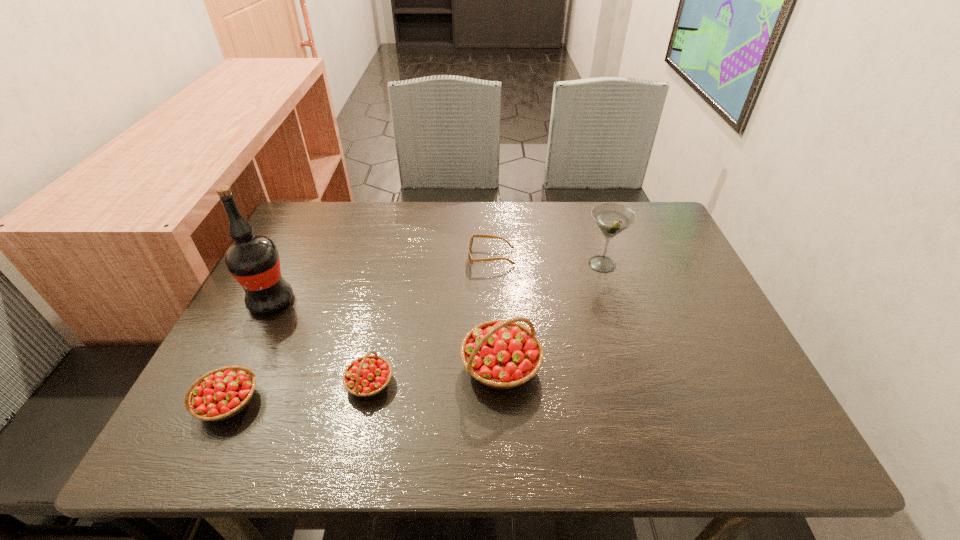
Identify the location of vacant area between the shortest object and the second tallest strawberry. Image resolution: width=960 pixels, height=540 pixels. (360, 329).

This screenshot has height=540, width=960. I want to click on blank region between the rightmost strawberry and the martini, so click(552, 315).

In order to click on free spot between the leftmost strawberry and the shortest object in this screenshot , I will do `click(360, 329)`.

At what (x,y) coordinates should I click in order to perform the action: click on vacant space that's between the third shortest object and the martini. Please return your answer as a coordinate pair (x, y). The height and width of the screenshot is (540, 960). Looking at the image, I should click on (416, 333).

Image resolution: width=960 pixels, height=540 pixels. Identify the location of free space between the second shortest strawberry and the rightmost object. (416, 333).

Find the location of a particular element. The image size is (960, 540). vacant point located between the sunglasses and the third farthest object is located at coordinates (381, 279).

Where is `vacant space in between the leftmost strawberry and the shortest object`? The image size is (960, 540). vacant space in between the leftmost strawberry and the shortest object is located at coordinates (360, 329).

At what (x,y) coordinates should I click in order to perform the action: click on object that is the third nearest to the second tallest strawberry. Please return your answer as a coordinate pair (x, y). The width and height of the screenshot is (960, 540). Looking at the image, I should click on (502, 354).

Locate which object ranks in proximity to the tallest strawberry. Please provide its 2D coordinates. Your answer should be formatted as a tuple, i.e. [(x, y)], where the tuple contains the x and y coordinates of a point satisfying the conditions above.

[(367, 376)]

At what (x,y) coordinates should I click in order to perform the action: click on strawberry that is the second closest one to the tallest strawberry. Please return your answer as a coordinate pair (x, y). The width and height of the screenshot is (960, 540). Looking at the image, I should click on (220, 394).